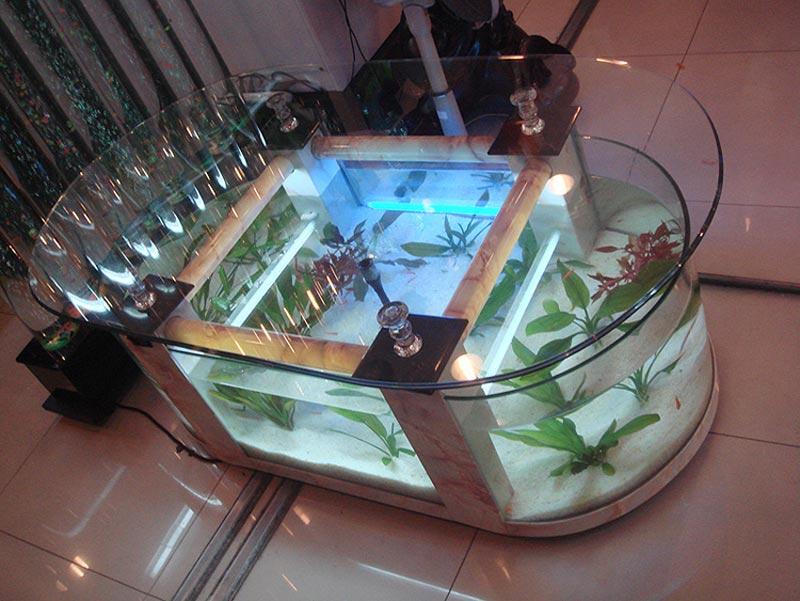
Locate an element on the screen. The image size is (800, 601). white tile floor is located at coordinates (638, 31).